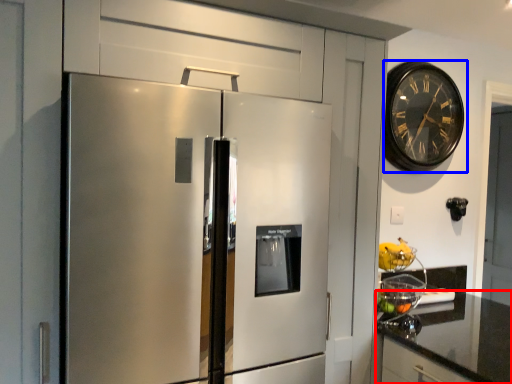
Question: Among these objects, which one is farthest to the camera, countertop (highlighted by a red box) or wall clock (highlighted by a blue box)?

Choices:
 (A) countertop
 (B) wall clock

Answer: (B)